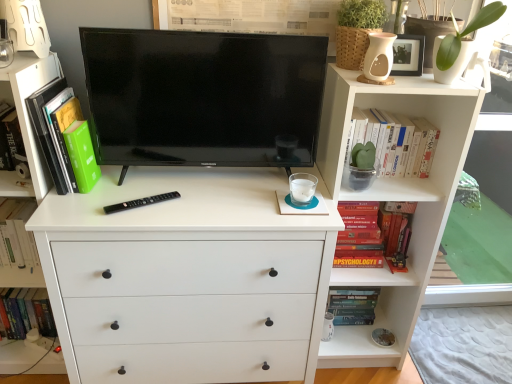
Question: Are white matte chest of drawers at center and hardcover book at left, which ranks as the fifth book in right-to-left order, far apart?

Choices:
 (A) yes
 (B) no

Answer: (B)

Question: Considering the relative sizes of white matte chest of drawers at center and hardcover book at left, the first book viewed from the left, in the image provided, is white matte chest of drawers at center taller than hardcover book at left, the first book viewed from the left,?

Choices:
 (A) no
 (B) yes

Answer: (B)

Question: Considering the relative sizes of white matte chest of drawers at center and hardcover book at left, the first book viewed from the left, in the image provided, is white matte chest of drawers at center smaller than hardcover book at left, the first book viewed from the left,?

Choices:
 (A) yes
 (B) no

Answer: (B)

Question: Is hardcover book at left, the first book viewed from the left, surrounded by white matte chest of drawers at center?

Choices:
 (A) yes
 (B) no

Answer: (B)

Question: From the image's perspective, is white matte chest of drawers at center beneath hardcover book at left, the first book viewed from the left?

Choices:
 (A) yes
 (B) no

Answer: (B)

Question: Is hardcover psychology book at right, which is the 4th book from left to right, inside the boundaries of white matte chest of drawers at center, or outside?

Choices:
 (A) inside
 (B) outside

Answer: (B)

Question: Is hardcover psychology book at right, the 2th book from the right, taller or shorter than white matte chest of drawers at center?

Choices:
 (A) tall
 (B) short

Answer: (B)

Question: Visually, is hardcover psychology book at right, which is the 4th book from left to right, positioned to the left or to the right of white matte chest of drawers at center?

Choices:
 (A) right
 (B) left

Answer: (A)

Question: Considering the positions of hardcover psychology book at right, which is the 4th book from left to right, and white matte chest of drawers at center in the image, is hardcover psychology book at right, which is the 4th book from left to right, wider or thinner than white matte chest of drawers at center?

Choices:
 (A) thin
 (B) wide

Answer: (A)

Question: Considering their positions, is black glossy tv at center located in front of or behind hardcover psychology book at right, the 2th book from the right?

Choices:
 (A) behind
 (B) front

Answer: (B)

Question: Considering the positions of black glossy tv at center and hardcover psychology book at right, which is the 4th book from left to right, in the image, is black glossy tv at center taller or shorter than hardcover psychology book at right, which is the 4th book from left to right,?

Choices:
 (A) short
 (B) tall

Answer: (B)

Question: From a real-world perspective, is black glossy tv at center above or below hardcover psychology book at right, the 2th book from the right?

Choices:
 (A) above
 (B) below

Answer: (A)

Question: Based on their positions, is black glossy tv at center located to the left or right of hardcover psychology book at right, which is the 4th book from left to right?

Choices:
 (A) left
 (B) right

Answer: (A)

Question: Considering the positions of white matte chest of drawers at center and hardcover book at left, the first book viewed from the left, in the image, is white matte chest of drawers at center bigger or smaller than hardcover book at left, the first book viewed from the left,?

Choices:
 (A) big
 (B) small

Answer: (A)

Question: Would you say white matte chest of drawers at center is inside or outside hardcover book at left, which ranks as the fifth book in right-to-left order?

Choices:
 (A) inside
 (B) outside

Answer: (B)